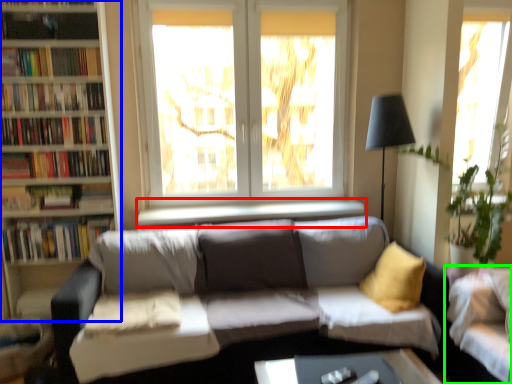
Question: Based on their relative distances, which object is farther from window sill (highlighted by a red box)? Choose from bookcase (highlighted by a blue box) and studio couch (highlighted by a green box).

Choices:
 (A) bookcase
 (B) studio couch

Answer: (B)